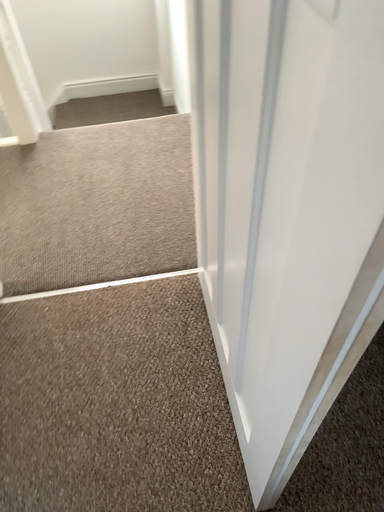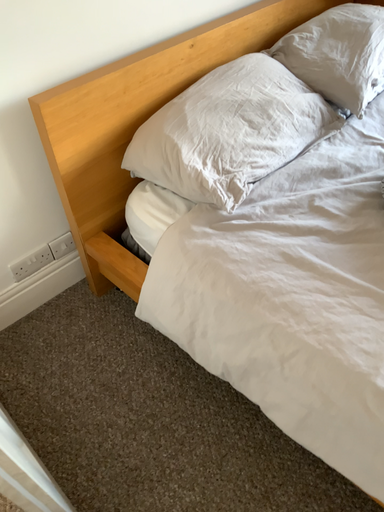
Question: How did the camera likely rotate when shooting the video?

Choices:
 (A) rotated downward
 (B) rotated upward

Answer: (B)